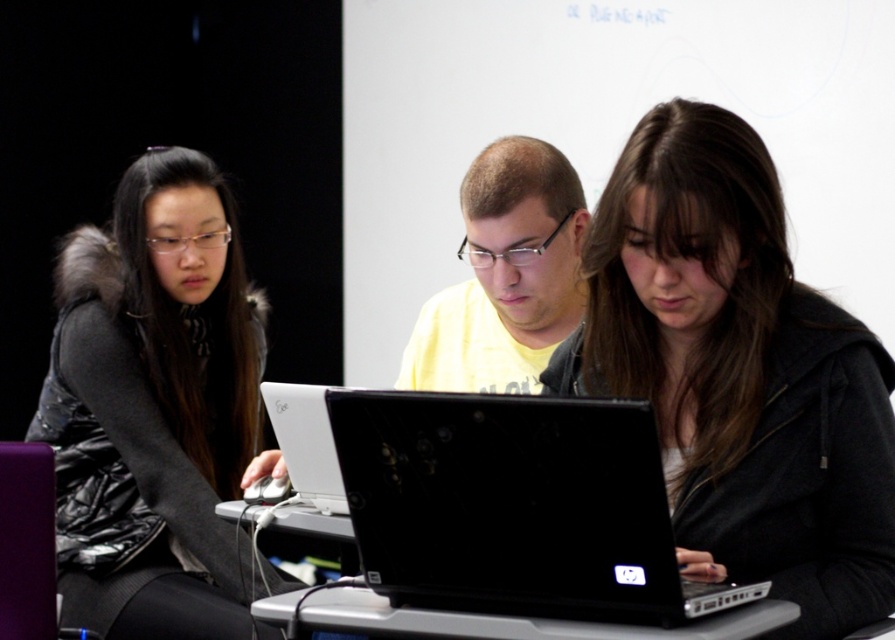
You are organizing a photo shoot and need to arrange two models wearing the matte black hoodie at center and the yellow matte shirt at center. Given their clothing sizes, which model should you place in the foreground to ensure they appear proportionally dominant in the final image?

The matte black hoodie at center has a larger size compared to the yellow matte shirt at center, so the model wearing the matte black hoodie at center should be placed in the foreground to maintain proportional dominance as larger objects typically appear more prominent when closer to the viewer.

You are a photographer trying to capture a group photo of the yellow matte shirt at center and the silver metallic table at center. Which object should you focus on first if you want to ensure both are in sharp focus?

The yellow matte shirt at center is thinner than the silver metallic table at center, so you should focus on the silver metallic table at center first to ensure depth of field covers both objects.